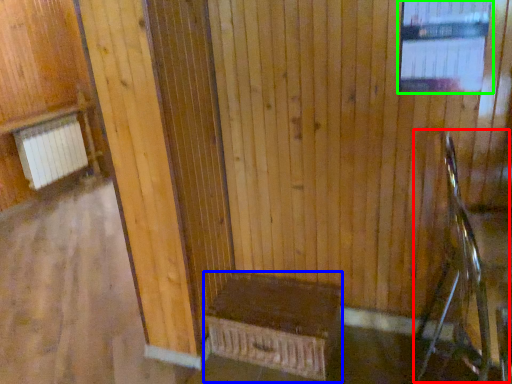
Question: Considering the real-world distances, which object is farthest from rocking chair (highlighted by a red box)? furniture (highlighted by a blue box) or window (highlighted by a green box)?

Choices:
 (A) furniture
 (B) window

Answer: (A)